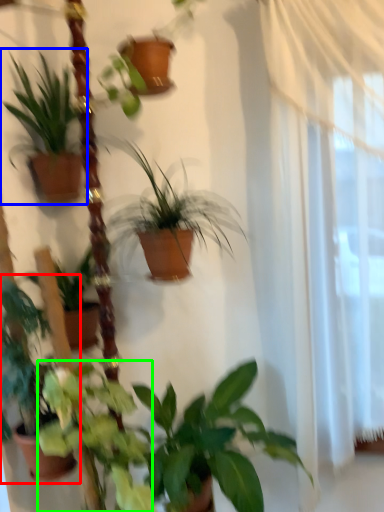
Question: Estimate the real-world distances between objects in this image. Which object is closer to houseplant (highlighted by a red box), houseplant (highlighted by a blue box) or plant (highlighted by a green box)?

Choices:
 (A) houseplant
 (B) plant

Answer: (B)